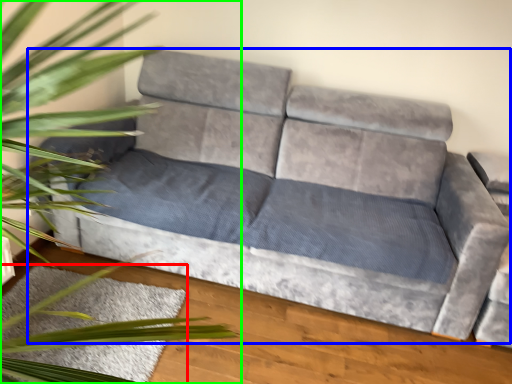
Question: Considering the real-world distances, which object is farthest from mat (highlighted by a red box)? studio couch (highlighted by a blue box) or houseplant (highlighted by a green box)?

Choices:
 (A) studio couch
 (B) houseplant

Answer: (A)